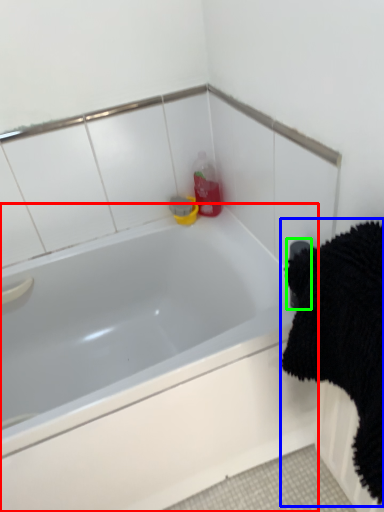
Question: Considering the real-world distances, which object is closest to bathtub (highlighted by a red box)? bath towel (highlighted by a blue box) or towel bar (highlighted by a green box).

Choices:
 (A) bath towel
 (B) towel bar

Answer: (A)